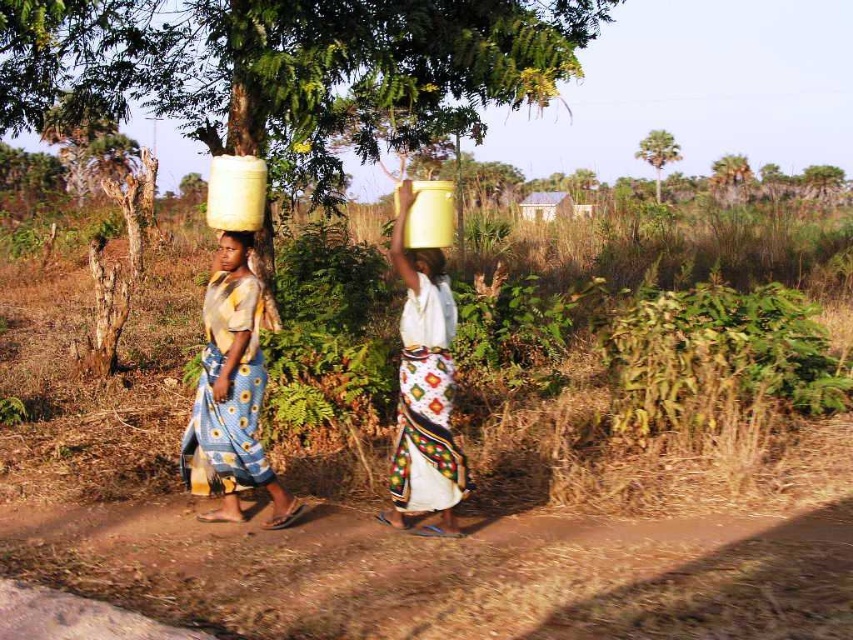
Can you confirm if smooth skin face at center is taller than matte yellow container at center?

Yes, smooth skin face at center is taller than matte yellow container at center.

Between smooth skin face at center and matte yellow container at center, which one is positioned higher?

smooth skin face at center is higher up.

Between point (241, 253) and point (410, 250), which one is positioned in front?

Positioned in front is point (241, 253).

Locate an element on the screen. This screenshot has width=853, height=640. smooth skin face at center is located at coordinates (233, 252).

Describe the element at coordinates (233, 388) in the screenshot. I see `blue printed fabric skirt at left` at that location.

The width and height of the screenshot is (853, 640). In order to click on blue printed fabric skirt at left in this screenshot , I will do `click(233, 388)`.

Describe the element at coordinates (422, 396) in the screenshot. The image size is (853, 640). I see `yellow matte water bucket at upper center` at that location.

Locate an element on the screen. The image size is (853, 640). yellow matte water bucket at upper center is located at coordinates (422, 396).

Who is more forward, (425, 400) or (413, 260)?

Point (425, 400) is in front.

Find the location of a particular element. This screenshot has height=640, width=853. yellow matte water bucket at upper center is located at coordinates coord(422,396).